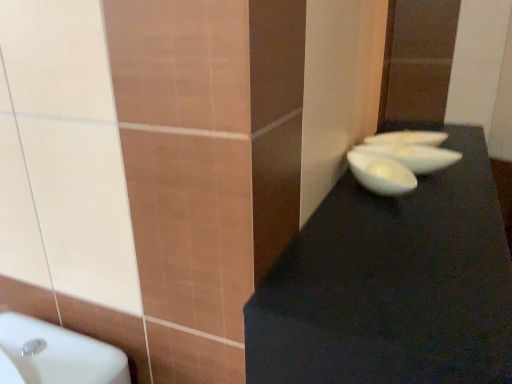
Identify the location of vacant area located to the right-hand side of white glossy bowl at center right. (458, 192).